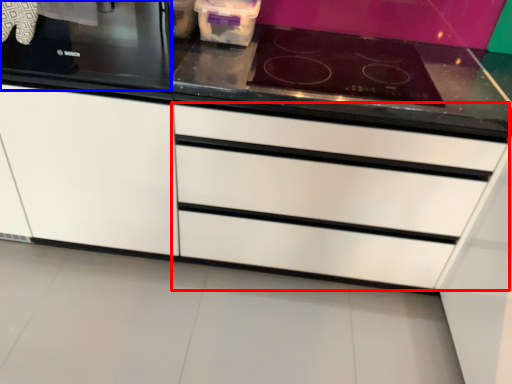
Question: Which of the following is the farthest to the observer, drawer (highlighted by a red box) or home appliance (highlighted by a blue box)?

Choices:
 (A) drawer
 (B) home appliance

Answer: (A)